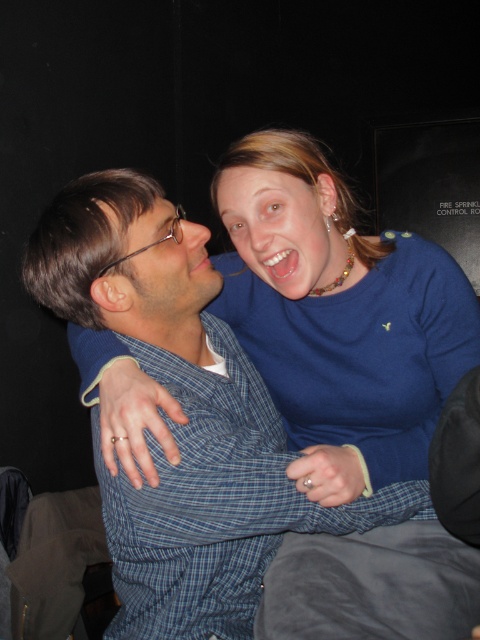
Question: Is blue fabric shirt at upper center below matte blue shirt at center?

Choices:
 (A) yes
 (B) no

Answer: (A)

Question: Observing the image, what is the correct spatial positioning of blue fabric shirt at upper center in reference to matte blue shirt at center?

Choices:
 (A) left
 (B) right

Answer: (B)

Question: Which is farther from the matte blue shirt at center?

Choices:
 (A) blue fabric shirt at upper center
 (B) blue fabric face at upper right

Answer: (A)

Question: Which is farther from the blue fabric face at upper right?

Choices:
 (A) blue fabric shirt at upper center
 (B) matte blue shirt at center

Answer: (A)

Question: Can you confirm if blue fabric shirt at upper center is bigger than blue fabric face at upper right?

Choices:
 (A) yes
 (B) no

Answer: (A)

Question: Which point is closer to the camera?

Choices:
 (A) blue fabric shirt at upper center
 (B) matte blue shirt at center

Answer: (A)